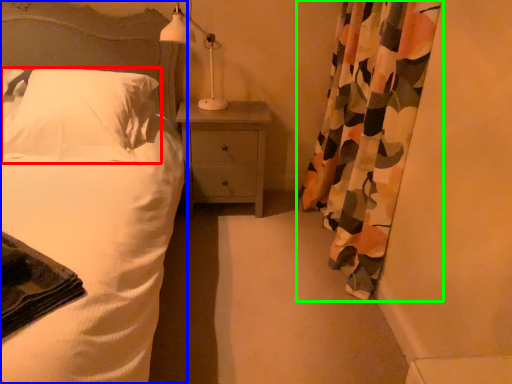
Question: Considering the real-world distances, which object is farthest from pillow (highlighted by a red box)? bed (highlighted by a blue box) or curtain (highlighted by a green box)?

Choices:
 (A) bed
 (B) curtain

Answer: (B)